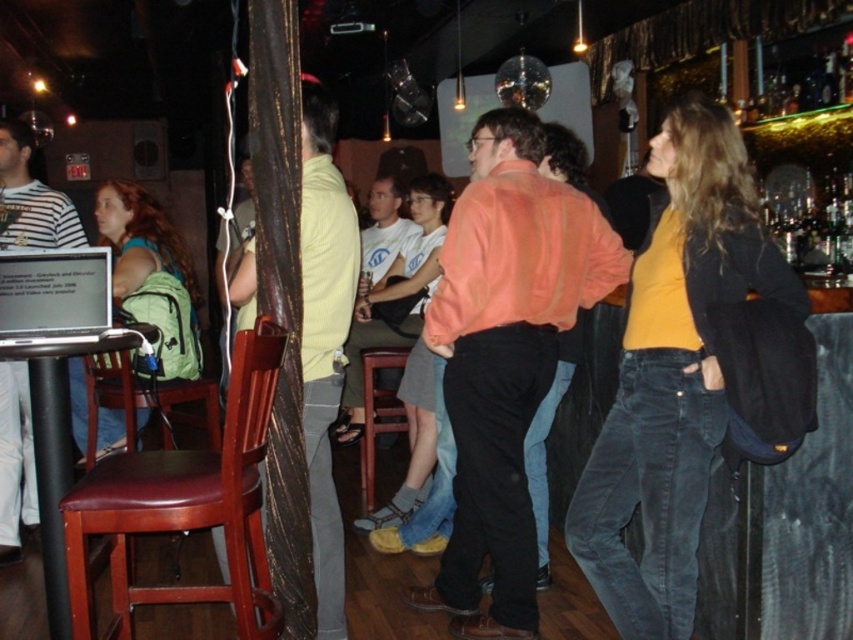
Question: Which of the following is the closest to the observer?

Choices:
 (A) matte orange shirt at center
 (B) light yellow shirt at center

Answer: (B)

Question: Is matte orange shirt at center positioned in front of brown leather bar stool at center?

Choices:
 (A) yes
 (B) no

Answer: (A)

Question: Can you confirm if matte orange shirt at center is thinner than clear glass bottles at bar right?

Choices:
 (A) yes
 (B) no

Answer: (A)

Question: Which of the following is the farthest from the observer?

Choices:
 (A) (844, 252)
 (B) (7, 380)
 (C) (496, 474)
 (D) (358, 468)

Answer: (D)

Question: Which of these objects is positioned farthest from the matte orange shirt at center?

Choices:
 (A) brown leather bar stool at center
 (B) striped cotton shirt at left

Answer: (B)

Question: From the image, what is the correct spatial relationship of striped cotton shirt at left in relation to white cotton shirt at center?

Choices:
 (A) left
 (B) right

Answer: (A)